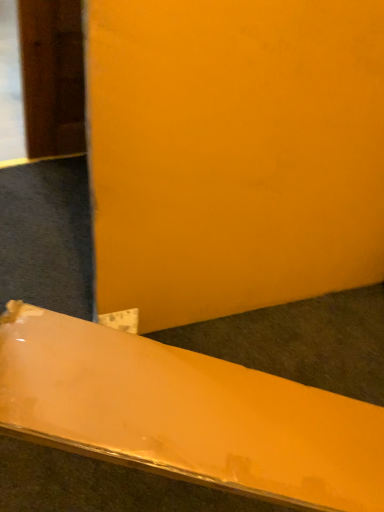
What do you see at coordinates (186, 413) in the screenshot?
I see `matte orange board at lower center` at bounding box center [186, 413].

Locate an element on the screen. The width and height of the screenshot is (384, 512). matte orange board at lower center is located at coordinates (186, 413).

At what (x,y) coordinates should I click in order to perform the action: click on matte orange board at lower center. Please return your answer as a coordinate pair (x, y). The height and width of the screenshot is (512, 384). Looking at the image, I should click on (186, 413).